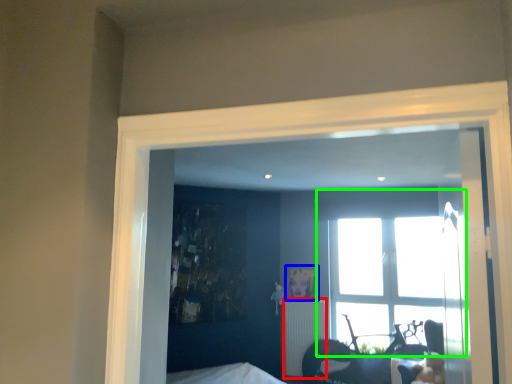
Question: Based on their relative distances, which object is nearer to radiator (highlighted by a red box)? Choose from picture frame (highlighted by a blue box) and window (highlighted by a green box).

Choices:
 (A) picture frame
 (B) window

Answer: (A)